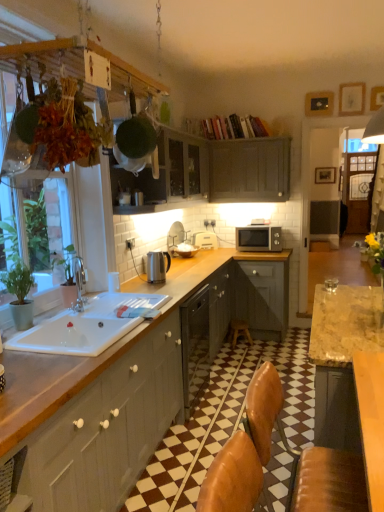
You are a GUI agent. You are given a task and a screenshot of the screen. Output one action in this format:
    pyautogui.click(x=<x>, y=<y>)
    Task: Click on the wooden stool at center
    Image resolution: width=384 pixels, height=512 pixels.
    Given the screenshot: What is the action you would take?
    pyautogui.click(x=239, y=331)

At what (x,y) coordinates should I click in order to perform the action: click on satin silver microwave at upper right. Please return your answer as a coordinate pair (x, y). Looking at the image, I should click on click(x=258, y=238).

What do you see at coordinates (10, 130) in the screenshot? This screenshot has height=512, width=384. I see `green matte plant hanger at upper left` at bounding box center [10, 130].

Locate an element on the screen. The image size is (384, 512). white plastic toaster at upper center, which is the 1th appliance in top-to-bottom order is located at coordinates (205, 240).

The width and height of the screenshot is (384, 512). In order to click on microwave oven that appears in front of the wooden picture frame at upper right in this screenshot , I will do `click(258, 238)`.

Can you confirm if wooden picture frame at upper right is wider than satin silver microwave at upper right?

Incorrect, the width of wooden picture frame at upper right does not surpass that of satin silver microwave at upper right.

Looking at this image, from the image's perspective, relative to satin silver microwave at upper right, is wooden picture frame at upper right above or below?

wooden picture frame at upper right is situated higher than satin silver microwave at upper right in the image.

How much distance is there between wooden picture frame at upper right and satin silver microwave at upper right?

wooden picture frame at upper right and satin silver microwave at upper right are 33.43 inches apart.

Does matte gray cabinet at upper center, which ranks as the 2th cabinetry in front-to-back order, have a lesser height compared to green matte plant hanger at upper left?

Yes.

Is matte gray cabinet at upper center, which ranks as the 2th cabinetry in front-to-back order, at the right side of green matte plant hanger at upper left?

Yes, matte gray cabinet at upper center, which ranks as the 2th cabinetry in front-to-back order, is to the right of green matte plant hanger at upper left.

From the image's perspective, would you say matte gray cabinet at upper center, which ranks as the 2th cabinetry in front-to-back order, is positioned over green matte plant hanger at upper left?

Indeed, from the image's perspective, matte gray cabinet at upper center, which ranks as the 2th cabinetry in front-to-back order, is shown above green matte plant hanger at upper left.

Where is `the 1st cabinetry behind the green matte plant hanger at upper left, starting your count from the anchor`? This screenshot has width=384, height=512. the 1st cabinetry behind the green matte plant hanger at upper left, starting your count from the anchor is located at coordinates (x=212, y=170).

Is wooden stool at center at the right side of satin silver kettle at counter, the first appliance when ordered from front to back?

Indeed, wooden stool at center is positioned on the right side of satin silver kettle at counter, the first appliance when ordered from front to back.

Which of these two, wooden stool at center or satin silver kettle at counter, the 2th appliance viewed from the back, is wider?

Wider between the two is wooden stool at center.

How many degrees apart are the facing directions of wooden stool at center and satin silver kettle at counter, which is the first appliance from bottom to top?

There is a 6.04-degree angle between the facing directions of wooden stool at center and satin silver kettle at counter, which is the first appliance from bottom to top.

Which of these two, white plastic toaster at upper center, which ranks as the second appliance in front-to-back order, or matte gray cabinet at upper center, placed as the 2th cabinetry when sorted from bottom to top, stands shorter?

white plastic toaster at upper center, which ranks as the second appliance in front-to-back order.

Who is more distant, white plastic toaster at upper center, which ranks as the second appliance in front-to-back order, or matte gray cabinet at upper center, the 2th cabinetry when ordered from top to bottom?

white plastic toaster at upper center, which ranks as the second appliance in front-to-back order, is further from the camera.

Consider the image. Considering the relative sizes of white plastic toaster at upper center, which is the 1th appliance in top-to-bottom order, and matte gray cabinet at upper center, positioned as the 2th cabinetry in back-to-front order, in the image provided, is white plastic toaster at upper center, which is the 1th appliance in top-to-bottom order, bigger than matte gray cabinet at upper center, positioned as the 2th cabinetry in back-to-front order,?

Incorrect, white plastic toaster at upper center, which is the 1th appliance in top-to-bottom order, is not larger than matte gray cabinet at upper center, positioned as the 2th cabinetry in back-to-front order.

From the image's perspective, which object appears higher, white plastic toaster at upper center, which is the 1th appliance in top-to-bottom order, or matte gray cabinet at upper center, the 2th cabinetry when ordered from top to bottom?

matte gray cabinet at upper center, the 2th cabinetry when ordered from top to bottom, is shown above in the image.

Which of these two, satin silver microwave at upper right or matte gray cabinet at upper center, which is the 1th cabinetry in top-to-bottom order, is smaller?

With smaller size is satin silver microwave at upper right.

Choose the correct answer: Is satin silver microwave at upper right inside matte gray cabinet at upper center, arranged as the 3th cabinetry when ordered from the bottom, or outside it?

satin silver microwave at upper right is not inside matte gray cabinet at upper center, arranged as the 3th cabinetry when ordered from the bottom, it's outside.

From the image's perspective, between satin silver microwave at upper right and matte gray cabinet at upper center, arranged as the 1th cabinetry when viewed from the back, who is located below?

satin silver microwave at upper right is shown below in the image.

Which is farther, (x=276, y=232) or (x=272, y=196)?

Point (x=276, y=232)

Is matte gray cabinet at upper center, placed as the 3th cabinetry when sorted from front to back, completely or partially outside of matte gray cabinet at left, placed as the first cabinetry when sorted from front to back?

matte gray cabinet at upper center, placed as the 3th cabinetry when sorted from front to back, lies outside matte gray cabinet at left, placed as the first cabinetry when sorted from front to back,'s area.

Which object is wider, matte gray cabinet at upper center, placed as the 3th cabinetry when sorted from front to back, or matte gray cabinet at left, marked as the third cabinetry in a top-to-bottom arrangement?

Wider between the two is matte gray cabinet at left, marked as the third cabinetry in a top-to-bottom arrangement.

How much distance is there between matte gray cabinet at upper center, placed as the 3th cabinetry when sorted from front to back, and matte gray cabinet at left, which is the 3th cabinetry in back-to-front order?

matte gray cabinet at upper center, placed as the 3th cabinetry when sorted from front to back, is 8.09 feet from matte gray cabinet at left, which is the 3th cabinetry in back-to-front order.

In the image, is matte gray cabinet at upper center, which is the 1th cabinetry in top-to-bottom order, on the left side or the right side of matte gray cabinet at left, placed as the first cabinetry when sorted from front to back?

Clearly, matte gray cabinet at upper center, which is the 1th cabinetry in top-to-bottom order, is on the right of matte gray cabinet at left, placed as the first cabinetry when sorted from front to back, in the image.

Is satin silver microwave at upper right at the left side of wooden picture frame at upper right?

Yes, satin silver microwave at upper right is to the left of wooden picture frame at upper right.

From a real-world perspective, relative to wooden picture frame at upper right, is satin silver microwave at upper right vertically above or below?

satin silver microwave at upper right is situated lower than wooden picture frame at upper right in the real world.

Consider the image. Would you say satin silver microwave at upper right contains wooden picture frame at upper right?

No, satin silver microwave at upper right does not contain wooden picture frame at upper right.

This screenshot has height=512, width=384. Identify the location of microwave oven beneath the wooden picture frame at upper right (from a real-world perspective). (258, 238).

Where is `microwave oven below the wooden picture frame at upper right (from the image's perspective)`? The width and height of the screenshot is (384, 512). microwave oven below the wooden picture frame at upper right (from the image's perspective) is located at coordinates (258, 238).

Which cabinetry is the 2nd one when counting from the right side of the green matte plant hanger at upper left? Please provide its 2D coordinates.

[(212, 170)]

When comparing their distances from white plastic toaster at upper center, the 1th appliance viewed from the right, does white ceramic sink at lower left or matte gray cabinet at left, which is the 3th cabinetry in back-to-front order, seem closer?

white ceramic sink at lower left.

Consider the image. When comparing their distances from white plastic toaster at upper center, the 1th appliance viewed from the right, does satin silver kettle at counter, placed as the 1th appliance when sorted from left to right, or matte gray cabinet at left, which is the 3th cabinetry in back-to-front order, seem further?

The object further to white plastic toaster at upper center, the 1th appliance viewed from the right, is matte gray cabinet at left, which is the 3th cabinetry in back-to-front order.

From the image, which object appears to be nearer to green matte plant hanger at upper left, matte gray cabinet at left, placed as the first cabinetry when sorted from front to back, or matte gray cabinet at upper center, the 2th cabinetry when ordered from top to bottom?

matte gray cabinet at left, placed as the first cabinetry when sorted from front to back, lies closer to green matte plant hanger at upper left than the other object.

Which object lies further to the anchor point wooden picture frame at upper right, satin silver microwave at upper right or satin silver kettle at counter, placed as the 1th appliance when sorted from left to right?

satin silver kettle at counter, placed as the 1th appliance when sorted from left to right, is further to wooden picture frame at upper right.

Considering their positions, is matte gray cabinet at upper center, which is the 1th cabinetry in top-to-bottom order, positioned further to matte gray cabinet at upper center, the 2th cabinetry when ordered from top to bottom, than white ceramic sink at lower left?

white ceramic sink at lower left is further to matte gray cabinet at upper center, the 2th cabinetry when ordered from top to bottom.

Considering their positions, is satin silver kettle at counter, the 2th appliance when ordered from right to left, positioned closer to wooden stool at center than matte gray cabinet at upper center, arranged as the 3th cabinetry when ordered from the bottom?

satin silver kettle at counter, the 2th appliance when ordered from right to left, is closer to wooden stool at center.

Which object lies nearer to the anchor point matte gray cabinet at upper center, positioned as the 2th cabinetry in back-to-front order, green matte plant hanger at upper left or white ceramic sink at lower left?

white ceramic sink at lower left is positioned closer to the anchor matte gray cabinet at upper center, positioned as the 2th cabinetry in back-to-front order.

Considering their positions, is white ceramic sink at lower left positioned closer to matte gray cabinet at left, marked as the third cabinetry in a top-to-bottom arrangement, than wooden picture frame at upper right?

white ceramic sink at lower left.

Identify the location of bar stool positioned between matte gray cabinet at upper center, placed as the 2th cabinetry when sorted from bottom to top, and satin silver microwave at upper right from near to far. (239, 331).

The image size is (384, 512). Identify the location of bar stool between green matte plant hanger at upper left and matte gray cabinet at upper center, arranged as the 1th cabinetry when viewed from the back, along the z-axis. (239, 331).

The width and height of the screenshot is (384, 512). In order to click on sink between matte gray cabinet at left, which is the 3th cabinetry in back-to-front order, and wooden stool at center in the front-back direction in this screenshot , I will do `click(86, 326)`.

You are a GUI agent. You are given a task and a screenshot of the screen. Output one action in this format:
    pyautogui.click(x=<x>, y=<y>)
    Task: Click on the appliance between matte gray cabinet at upper center, which ranks as the 2th cabinetry in front-to-back order, and satin silver microwave at upper right in the front-back direction
    
    Given the screenshot: What is the action you would take?
    pyautogui.click(x=157, y=266)